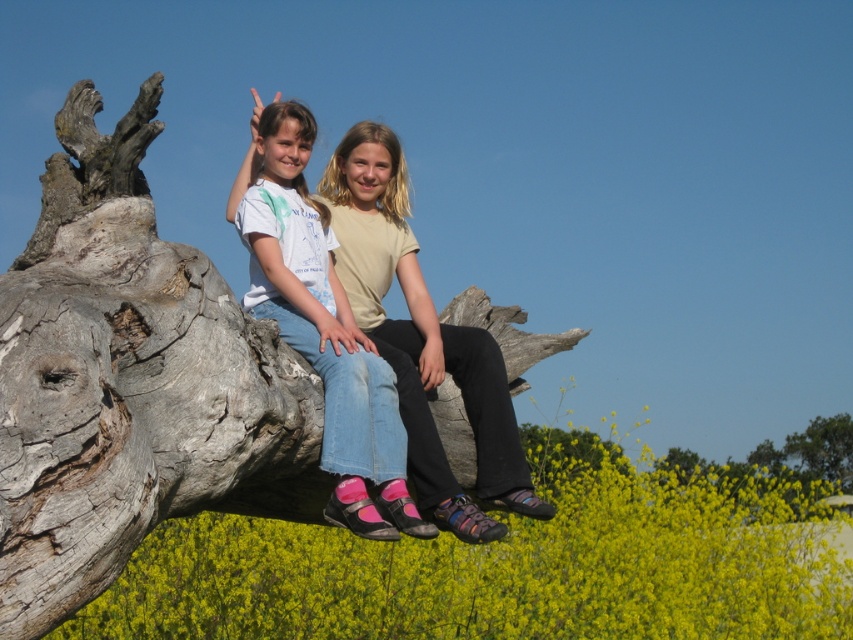
You are a photographer trying to capture a photo of the gray rough tree trunk at center and the green leafy tree at upper right. Since you want both trees to be clearly visible in the frame, which tree should you focus on first to ensure proper depth of field?

The gray rough tree trunk at center is taller than the green leafy tree at upper right, so you should focus on the taller gray rough tree trunk at center first to ensure both are in focus.